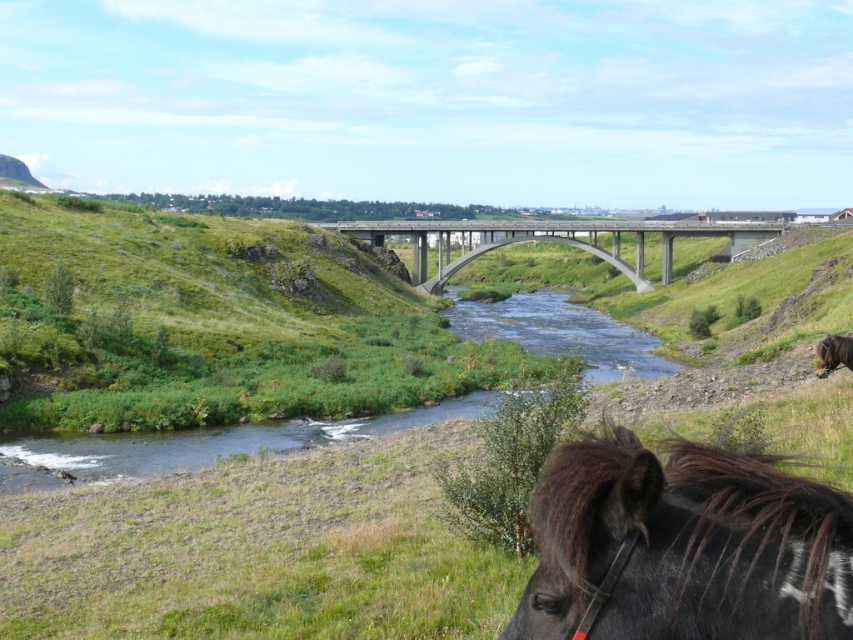
Who is lower down, green grassy at center or concrete bridge at center?

green grassy at center is below.

Is green grassy at center above concrete bridge at center?

No, green grassy at center is not above concrete bridge at center.

Between point (292, 586) and point (434, 225), which one is positioned behind?

The point (434, 225) is behind.

You are a GUI agent. You are given a task and a screenshot of the screen. Output one action in this format:
    pyautogui.click(x=<x>, y=<y>)
    Task: Click on the green grassy at center
    
    Given the screenshot: What is the action you would take?
    pyautogui.click(x=258, y=552)

Is black glossy horse at lower right taller than concrete bridge at center?

Incorrect, black glossy horse at lower right's height is not larger of concrete bridge at center's.

Which of these two, black glossy horse at lower right or concrete bridge at center, stands shorter?

With less height is black glossy horse at lower right.

Is point (734, 536) more distant than point (778, 227)?

No, it is in front of (778, 227).

In order to click on black glossy horse at lower right in this screenshot , I will do `click(683, 547)`.

The height and width of the screenshot is (640, 853). What do you see at coordinates (258, 552) in the screenshot?
I see `green grassy at center` at bounding box center [258, 552].

Is point (165, 515) more distant than point (820, 349)?

No, it is in front of (820, 349).

Where is `green grassy at center`? green grassy at center is located at coordinates (258, 552).